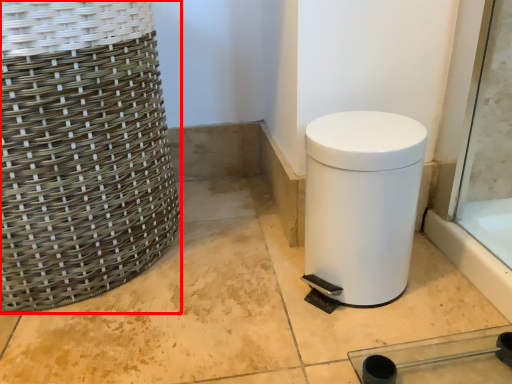
Question: From the image's perspective, considering the relative positions of basket (annotated by the red box) and waste container in the image provided, where is basket (annotated by the red box) located with respect to the staircase?

Choices:
 (A) below
 (B) above

Answer: (B)